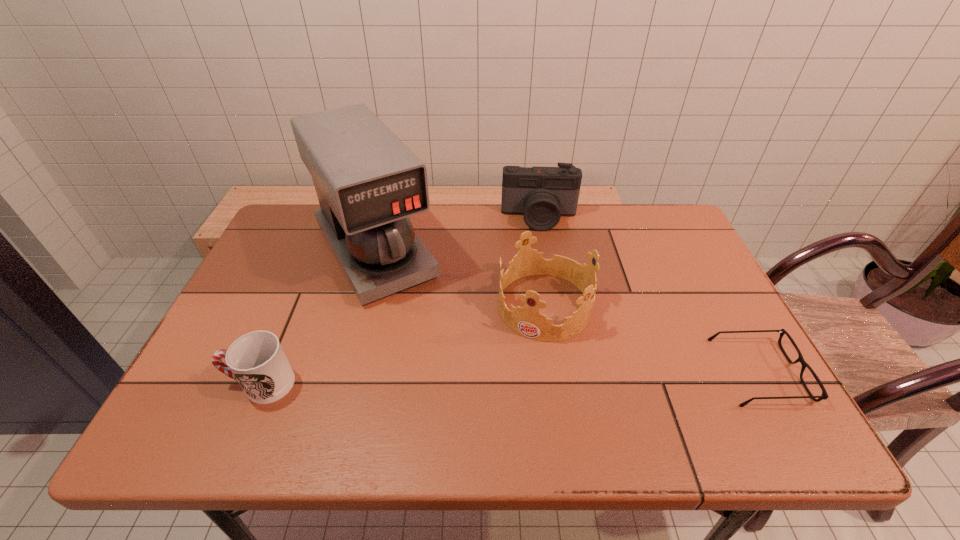
The width and height of the screenshot is (960, 540). Find the location of `object that is at the far left corner`. object that is at the far left corner is located at coordinates (368, 182).

You are a GUI agent. You are given a task and a screenshot of the screen. Output one action in this format:
    pyautogui.click(x=<x>, y=<y>)
    Task: Click on the object that is positioned at the near left corner
    The image size is (960, 540).
    Given the screenshot: What is the action you would take?
    pyautogui.click(x=256, y=360)

What are the coordinates of `object at the near right corner` in the screenshot? It's located at (824, 396).

Where is `free region at the far edge of the desktop`? free region at the far edge of the desktop is located at coordinates (532, 248).

I want to click on free region at the near edge, so click(441, 403).

In the image, there is a desktop. Where is `free space at the left edge`? The image size is (960, 540). free space at the left edge is located at coordinates pyautogui.click(x=240, y=293).

Identify the location of vacant space at the far right corner. (660, 212).

The height and width of the screenshot is (540, 960). Identify the location of vacant region between the tiara and the rightmost object. (652, 339).

The image size is (960, 540). Identify the location of free area in between the coffee maker and the tiara. (460, 278).

Find the location of a particular element. The width and height of the screenshot is (960, 540). vacant area that lies between the spectacles and the camera is located at coordinates (649, 295).